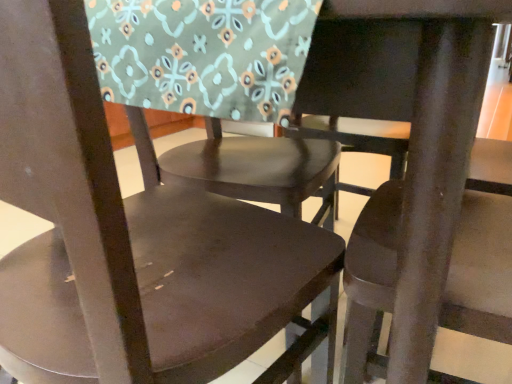
Question: From a real-world perspective, is matte brown chair at center, which ranks as the third chair in left-to-right order, above or below matte brown chair at center, placed as the second chair when sorted from right to left?

Choices:
 (A) below
 (B) above

Answer: (A)

Question: Is matte brown chair at center, which appears as the 1th chair when viewed from the right, taller or shorter than matte brown chair at center, placed as the second chair when sorted from right to left?

Choices:
 (A) short
 (B) tall

Answer: (B)

Question: Which object is positioned farthest from the matte brown chair at center, arranged as the 2th chair when viewed from the left?

Choices:
 (A) matte brown chair at center, which appears as the 1th chair when viewed from the right
 (B) matte brown chair at center, the 3th chair viewed from the right

Answer: (A)

Question: Considering the real-world distances, which object is farthest from the matte brown chair at center, which ranks as the third chair in left-to-right order?

Choices:
 (A) matte brown chair at center, placed as the second chair when sorted from right to left
 (B) matte brown chair at center, which is counted as the first chair, starting from the left

Answer: (A)